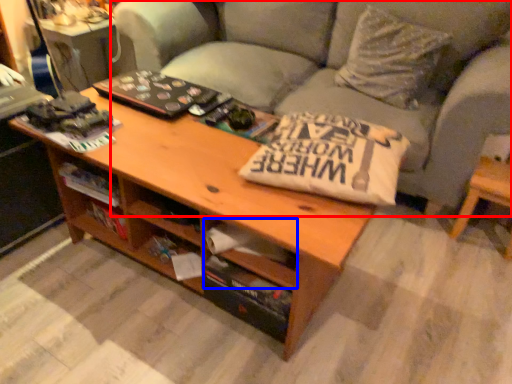
Question: Which point is closer to the camera, studio couch (highlighted by a red box) or drawer (highlighted by a blue box)?

Choices:
 (A) studio couch
 (B) drawer

Answer: (B)